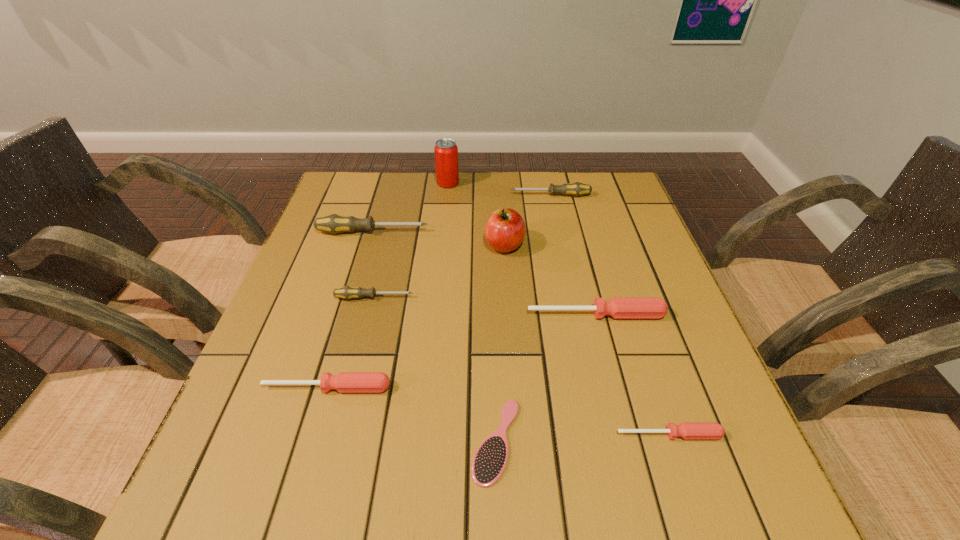
Point out which screwdriver is positioned as the fourth nearest to the hairbrush. Please provide its 2D coordinates. Your answer should be formatted as a tuple, i.e. [(x, y)], where the tuple contains the x and y coordinates of a point satisfying the conditions above.

[(347, 292)]

In order to click on gray screwdriver that is the second closest to the smallest red screwdriver in this screenshot , I will do `click(334, 223)`.

Identify which gray screwdriver is the second closest to the nearest screwdriver. Please provide its 2D coordinates. Your answer should be formatted as a tuple, i.e. [(x, y)], where the tuple contains the x and y coordinates of a point satisfying the conditions above.

[(334, 223)]

The image size is (960, 540). In order to click on the third closest red screwdriver to the seventh shortest object in this screenshot , I will do `click(687, 430)`.

Identify the location of red screwdriver object that ranks as the closest to the second farthest red screwdriver. (618, 307).

Locate an element on the screen. Image resolution: width=960 pixels, height=540 pixels. free space in the image that satisfies the following two spatial constraints: 1. at the tip of the smallest gray screwdriver; 2. on the right side of the fourth farthest screwdriver is located at coordinates (371, 315).

I want to click on vacant point that satisfies the following two spatial constraints: 1. on the back side of the biggest red screwdriver; 2. at the tip of the third farthest screwdriver, so click(x=591, y=298).

This screenshot has height=540, width=960. Identify the location of free space that satisfies the following two spatial constraints: 1. at the tip of the shortest object; 2. on the right side of the biggest gray screwdriver. (311, 441).

Where is `vacant area that satisfies the following two spatial constraints: 1. at the tip of the biggest gray screwdriver; 2. on the left side of the second nearest red screwdriver`? vacant area that satisfies the following two spatial constraints: 1. at the tip of the biggest gray screwdriver; 2. on the left side of the second nearest red screwdriver is located at coordinates (327, 388).

Find the location of a particular element. This screenshot has width=960, height=540. free space that satisfies the following two spatial constraints: 1. at the tip of the nearest red screwdriver; 2. on the right side of the eighth nearest object is located at coordinates (602, 435).